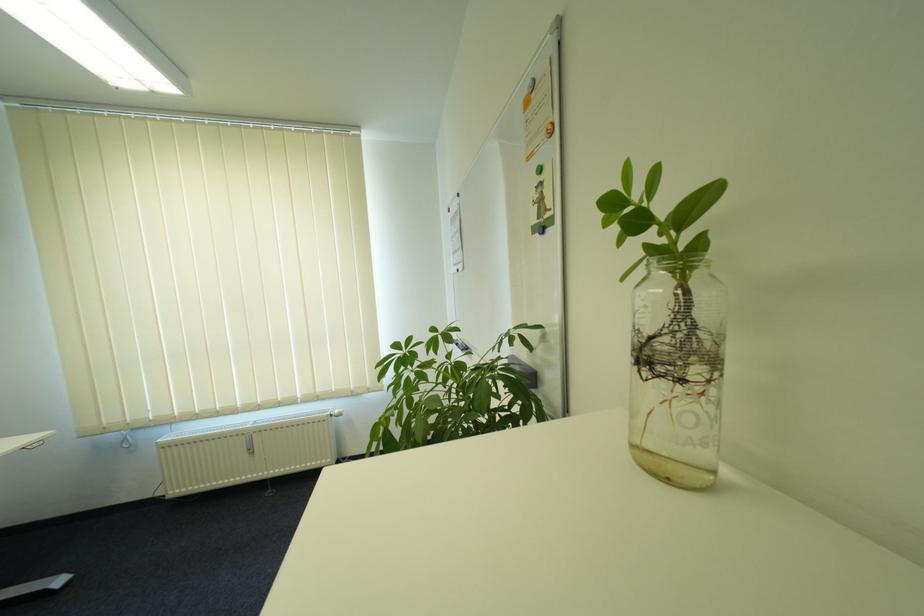
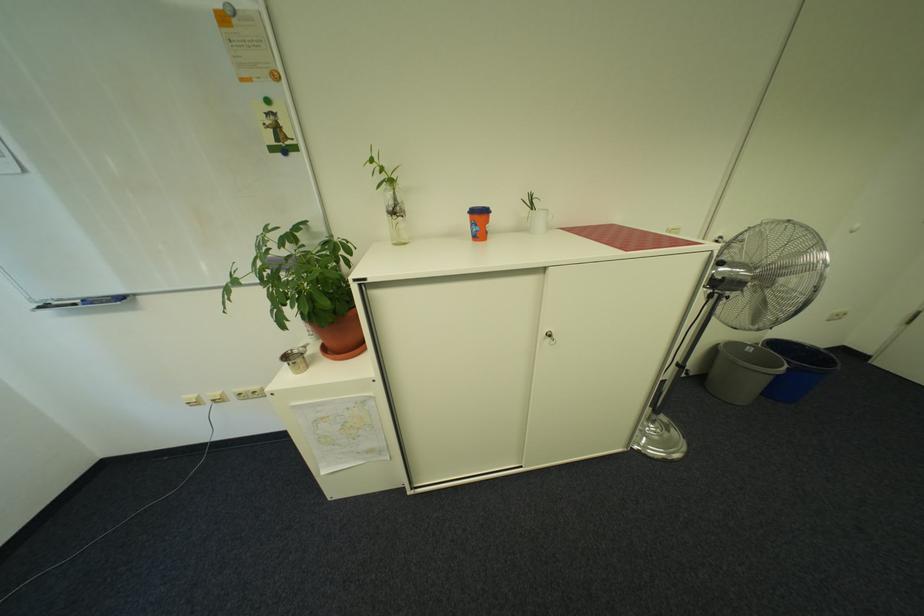
Based on the continuous images, in which direction is the camera rotating?

The camera rotated toward right-down.